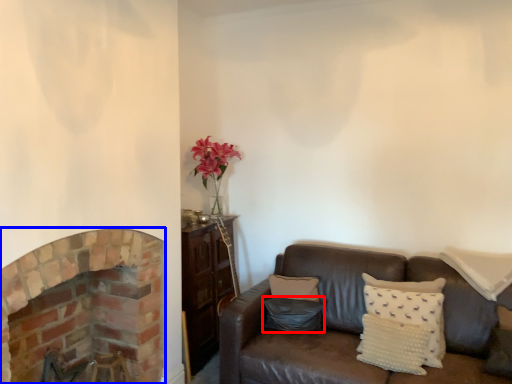
Question: Among these objects, which one is nearest to the camera, pillow (highlighted by a red box) or fireplace (highlighted by a blue box)?

Choices:
 (A) pillow
 (B) fireplace

Answer: (B)